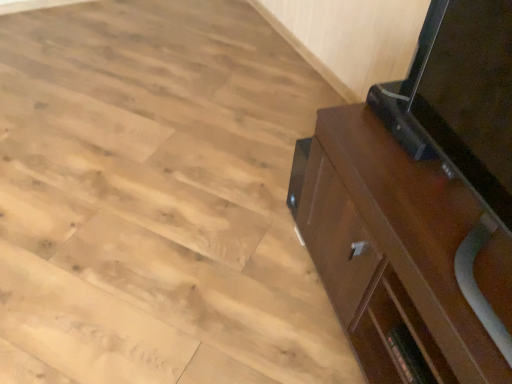
Where is `free spot to the left of dark brown wood cabinet at right`? Image resolution: width=512 pixels, height=384 pixels. free spot to the left of dark brown wood cabinet at right is located at coordinates (233, 281).